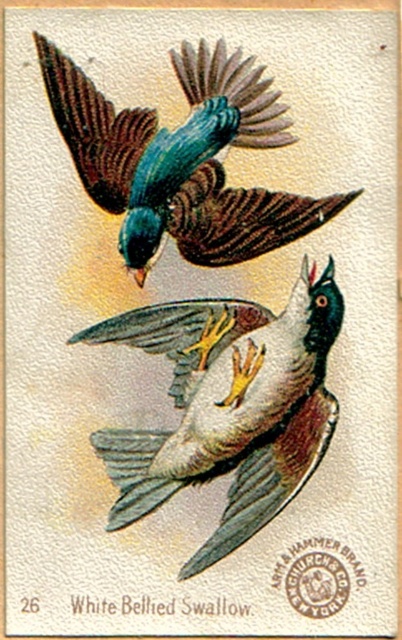
Does point (118, 512) lie behind point (151, 180)?

No, it is not.

Is white feathered bird at center behind shiny blue-green bird at upper center?

Yes, white feathered bird at center is behind shiny blue-green bird at upper center.

At what (x,y) coordinates should I click in order to perform the action: click on white feathered bird at center. Please return your answer as a coordinate pair (x, y). This screenshot has width=402, height=640. Looking at the image, I should click on pyautogui.click(x=227, y=404).